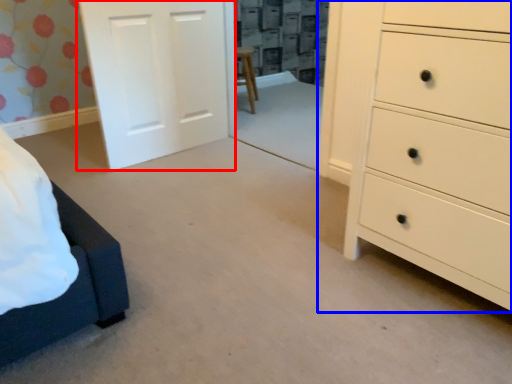
Question: Which of the following is the farthest to the observer, door (highlighted by a red box) or chest of drawers (highlighted by a blue box)?

Choices:
 (A) door
 (B) chest of drawers

Answer: (A)